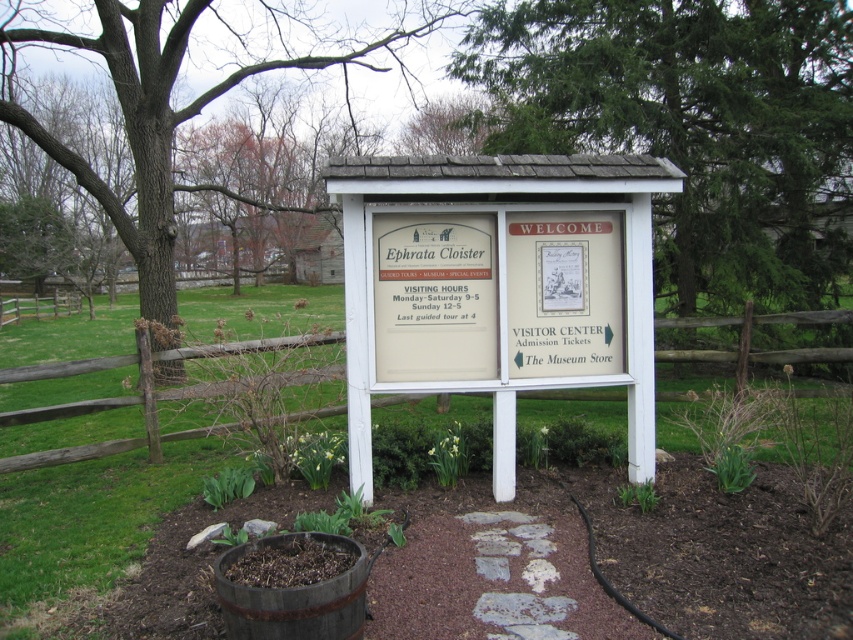
Question: Among these points, which one is nearest to the camera?

Choices:
 (A) (120, 108)
 (B) (646, 109)
 (C) (241, 608)

Answer: (C)

Question: Can you confirm if green leafy tree at center is positioned below rustic wooden barrel at lower center?

Choices:
 (A) no
 (B) yes

Answer: (A)

Question: Which is nearer to the brown wooden fence at center?

Choices:
 (A) green leafy tree at center
 (B) rustic wooden barrel at lower center
 (C) brown rough bark tree at upper left

Answer: (B)

Question: Can you confirm if brown rough bark tree at upper left is thinner than brown wooden fence at center?

Choices:
 (A) no
 (B) yes

Answer: (A)

Question: Which of the following is the farthest from the observer?

Choices:
 (A) (584, 10)
 (B) (309, 621)

Answer: (A)

Question: Is green leafy tree at center positioned behind rustic wooden barrel at lower center?

Choices:
 (A) yes
 (B) no

Answer: (A)